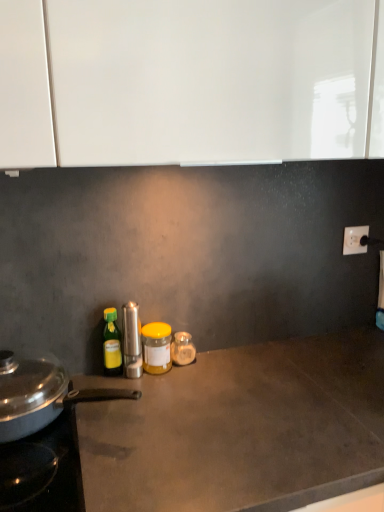
At what (x,y) coordinates should I click in order to perform the action: click on vacant space in front of yellow matte jar at center, which is the 2th bottle from right to left. Please return your answer as a coordinate pair (x, y). The image size is (384, 512). Looking at the image, I should click on (153, 399).